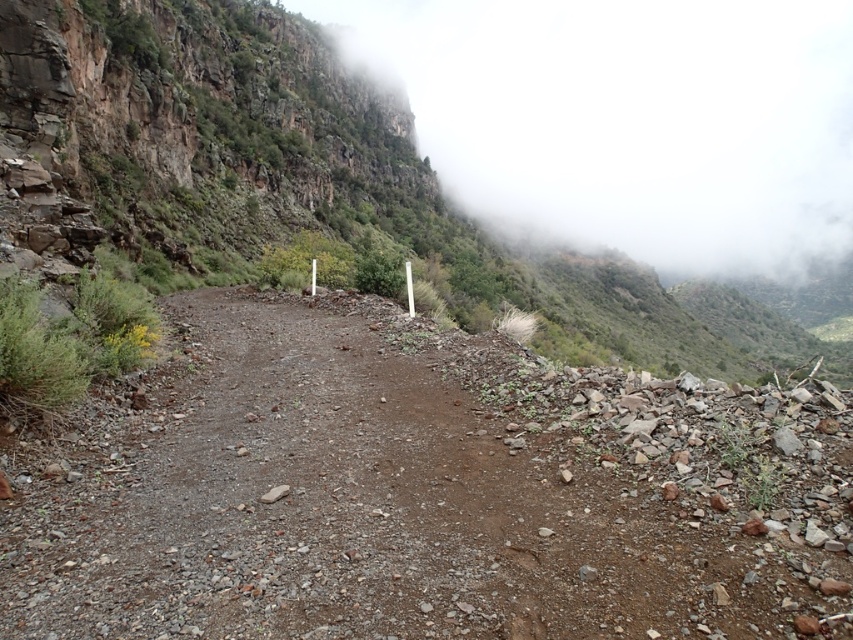
Question: Which object appears closest to the camera in this image?

Choices:
 (A) foggy misty cliff at upper center
 (B) dull brown dirt track at center

Answer: (B)

Question: Does dull brown dirt track at center appear over foggy misty cliff at upper center?

Choices:
 (A) yes
 (B) no

Answer: (B)

Question: Which of the following is the farthest from the observer?

Choices:
 (A) dull brown dirt track at center
 (B) foggy misty cliff at upper center

Answer: (B)

Question: Is dull brown dirt track at center thinner than foggy misty cliff at upper center?

Choices:
 (A) yes
 (B) no

Answer: (A)

Question: Observing the image, what is the correct spatial positioning of dull brown dirt track at center in reference to foggy misty cliff at upper center?

Choices:
 (A) right
 (B) left

Answer: (B)